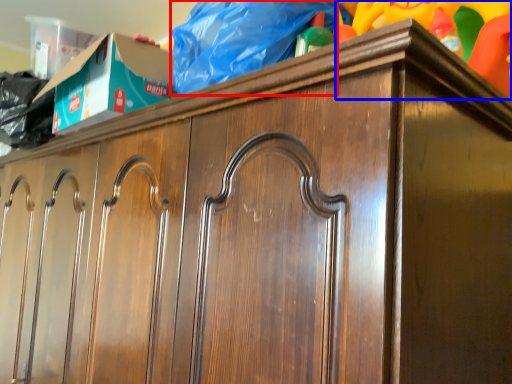
Question: Which object is closer to the camera taking this photo, material (highlighted by a red box) or toy (highlighted by a blue box)?

Choices:
 (A) material
 (B) toy

Answer: (B)